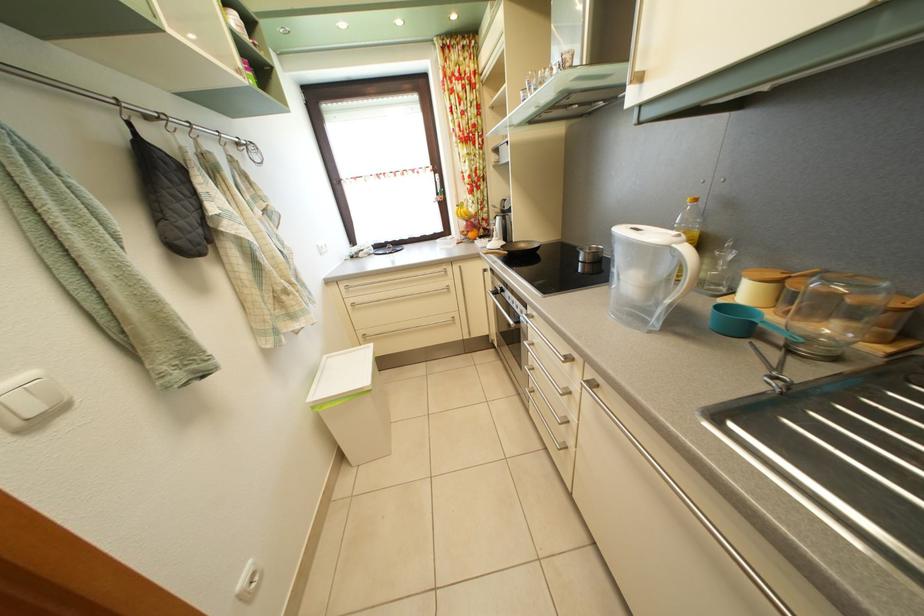
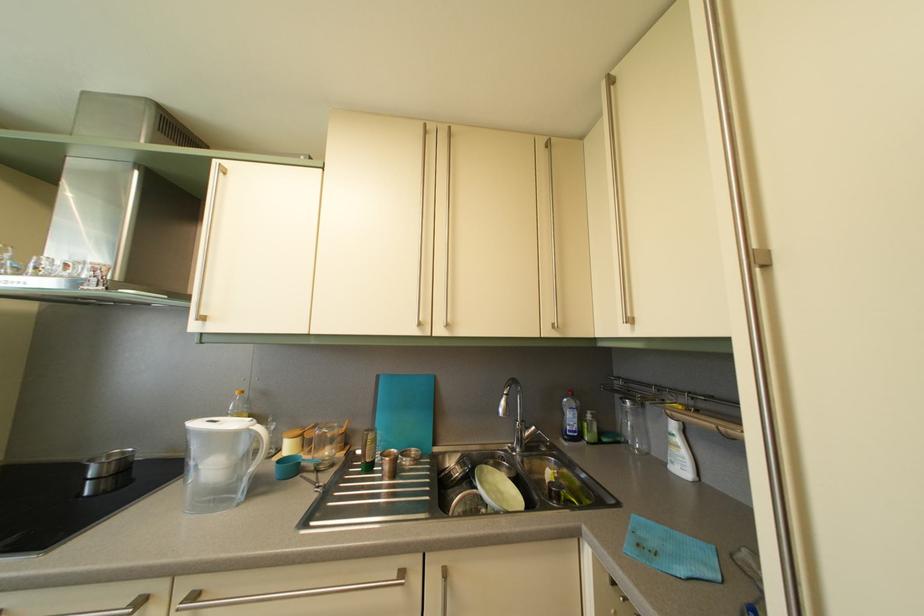
Locate, in the second image, the point that corresponds to [695,256] in the first image.

(266, 436)